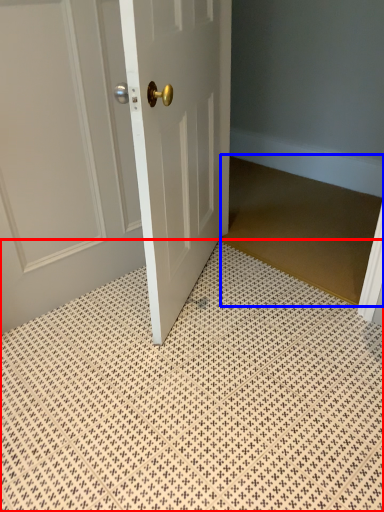
Question: Which point is closer to the camera, bath mat (highlighted by a red box) or doormat (highlighted by a blue box)?

Choices:
 (A) bath mat
 (B) doormat

Answer: (A)